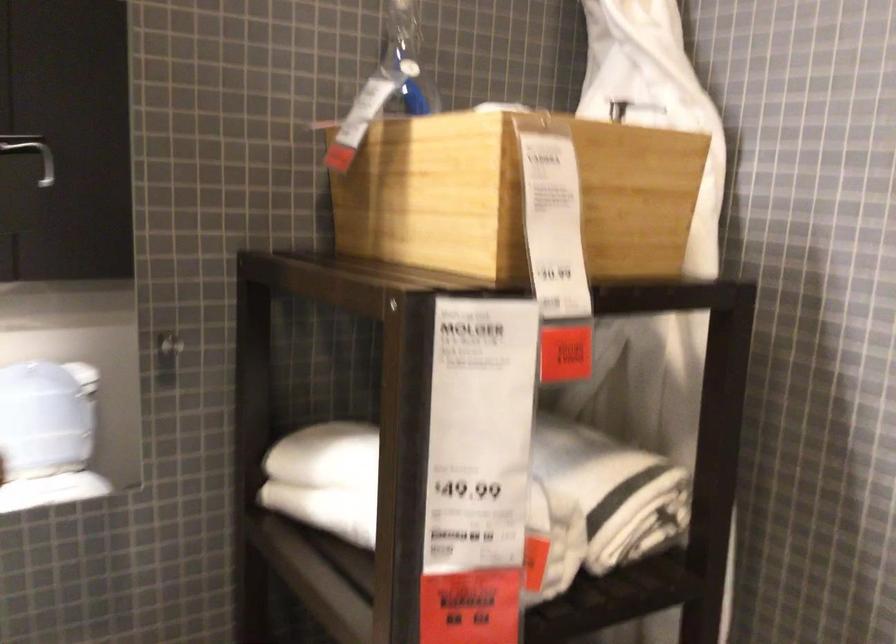
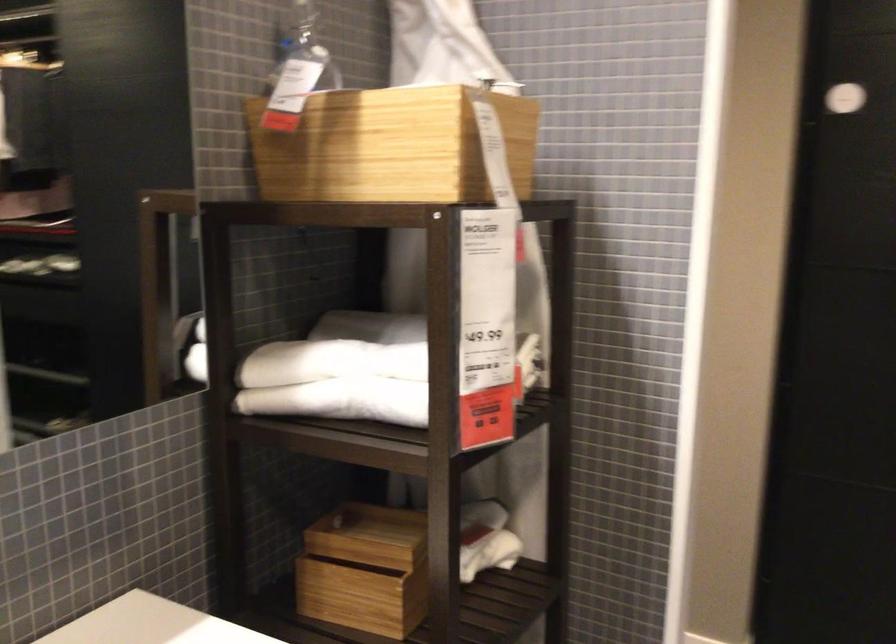
Where in the second image is the point corresponding to the point at 350,522 from the first image?

(341, 401)